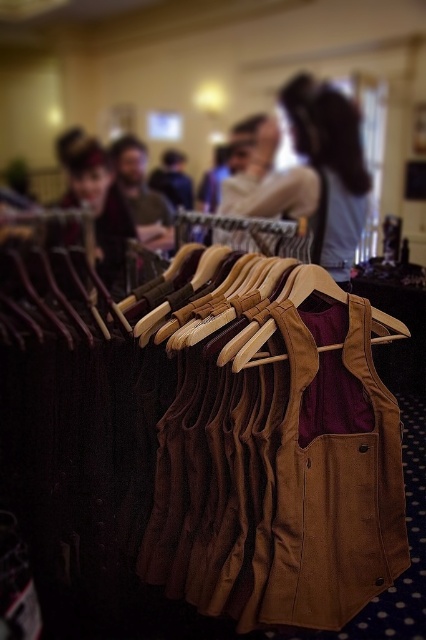
Question: Is light brown leather vest at center above velvet burgundy vest at center?

Choices:
 (A) yes
 (B) no

Answer: (A)

Question: Is velvet burgundy vest at center above brown suede vest at center?

Choices:
 (A) yes
 (B) no

Answer: (B)

Question: Among these objects, which one is nearest to the camera?

Choices:
 (A) brown suede vest at center
 (B) velvet burgundy vest at center
 (C) light brown leather vest at center

Answer: (B)

Question: Which point is closer to the camera?

Choices:
 (A) (164, 186)
 (B) (359, 136)

Answer: (A)

Question: Which point is closer to the camera?

Choices:
 (A) (337, 97)
 (B) (118, 252)

Answer: (B)

Question: Is the position of light brown leather vest at center less distant than that of velvet burgundy vest at center?

Choices:
 (A) yes
 (B) no

Answer: (B)